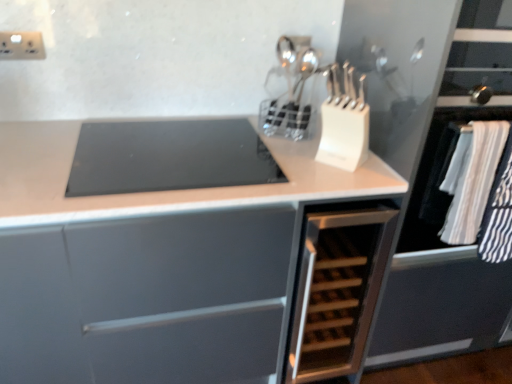
Question: Considering the relative sizes of black glass cooktop at center and wooden rack at center, the second cabinetry viewed from the left, in the image provided, is black glass cooktop at center wider than wooden rack at center, the second cabinetry viewed from the left,?

Choices:
 (A) no
 (B) yes

Answer: (A)

Question: Can you confirm if black glass cooktop at center is shorter than wooden rack at center, the second cabinetry viewed from the left?

Choices:
 (A) no
 (B) yes

Answer: (B)

Question: From the image's perspective, is black glass cooktop at center located above wooden rack at center, the second cabinetry viewed from the left?

Choices:
 (A) yes
 (B) no

Answer: (A)

Question: Could you tell me if black glass cooktop at center is turned towards wooden rack at center, which appears as the first cabinetry when viewed from the right?

Choices:
 (A) no
 (B) yes

Answer: (A)

Question: Considering the relative sizes of black glass cooktop at center and wooden rack at center, which appears as the first cabinetry when viewed from the right, in the image provided, is black glass cooktop at center smaller than wooden rack at center, which appears as the first cabinetry when viewed from the right,?

Choices:
 (A) yes
 (B) no

Answer: (A)

Question: Is black glass cooktop at center touching wooden rack at center, which appears as the first cabinetry when viewed from the right?

Choices:
 (A) no
 (B) yes

Answer: (A)

Question: Considering the relative sizes of white plastic knife block at upper center and wooden rack at center, which appears as the first cabinetry when viewed from the right, in the image provided, is white plastic knife block at upper center bigger than wooden rack at center, which appears as the first cabinetry when viewed from the right,?

Choices:
 (A) no
 (B) yes

Answer: (A)

Question: Considering the relative sizes of white plastic knife block at upper center and wooden rack at center, which appears as the first cabinetry when viewed from the right, in the image provided, is white plastic knife block at upper center taller than wooden rack at center, which appears as the first cabinetry when viewed from the right,?

Choices:
 (A) yes
 (B) no

Answer: (B)

Question: Does white plastic knife block at upper center have a lesser width compared to wooden rack at center, the second cabinetry viewed from the left?

Choices:
 (A) yes
 (B) no

Answer: (A)

Question: Can you confirm if white plastic knife block at upper center is wider than wooden rack at center, the second cabinetry viewed from the left?

Choices:
 (A) no
 (B) yes

Answer: (A)

Question: Does white plastic knife block at upper center lie behind wooden rack at center, which appears as the first cabinetry when viewed from the right?

Choices:
 (A) no
 (B) yes

Answer: (A)

Question: Is white plastic knife block at upper center completely or partially outside of wooden rack at center, the second cabinetry viewed from the left?

Choices:
 (A) no
 (B) yes

Answer: (B)

Question: Does white plastic knife block at upper center appear on the right side of white striped fabric at right?

Choices:
 (A) yes
 (B) no

Answer: (B)